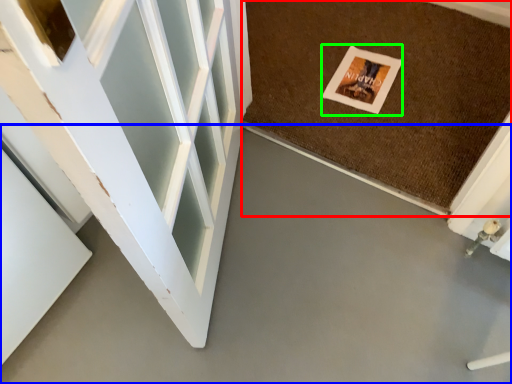
Question: Which object is positioned closest to mat (highlighted by a red box)? Select from concrete (highlighted by a blue box) and postcard (highlighted by a green box).

Choices:
 (A) concrete
 (B) postcard

Answer: (B)